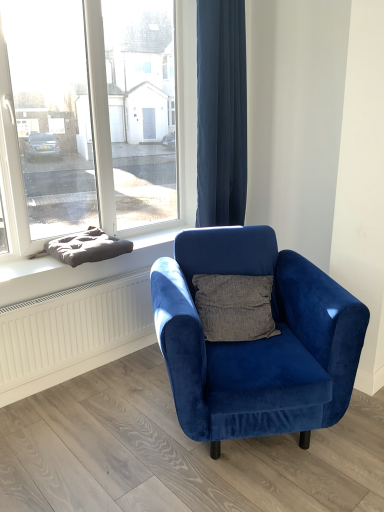
This screenshot has height=512, width=384. In order to click on spots to the right of white textured radiator at lower left in this screenshot , I will do `click(132, 369)`.